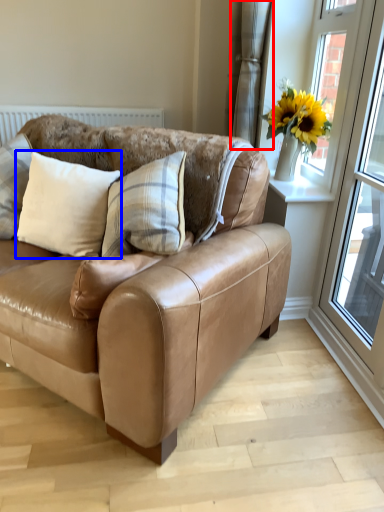
Question: Among these objects, which one is farthest to the camera, curtain (highlighted by a red box) or pillow (highlighted by a blue box)?

Choices:
 (A) curtain
 (B) pillow

Answer: (A)